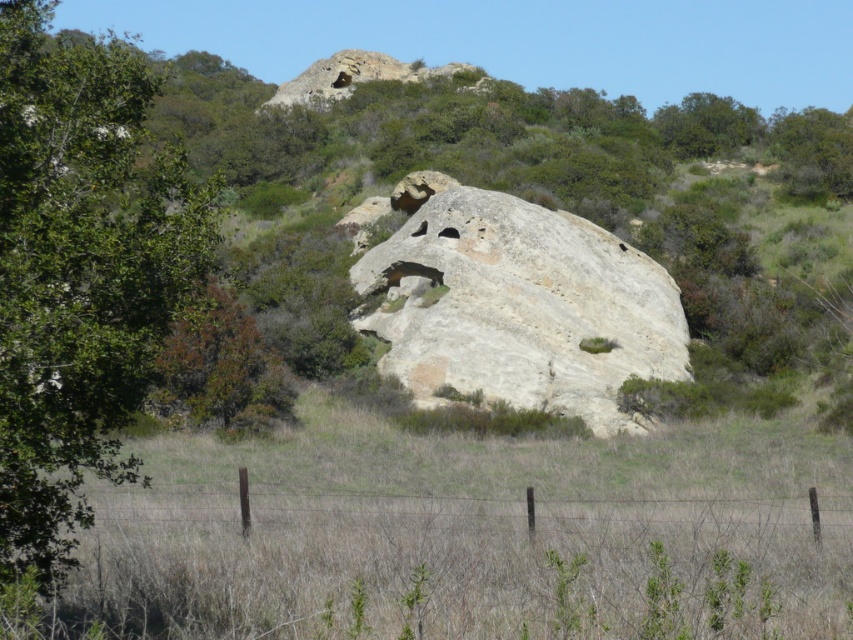
What do you see at coordinates (515, 305) in the screenshot? I see `light gray rock at center` at bounding box center [515, 305].

How much distance is there between light gray rock at center and green leafy shrub at center-left?

light gray rock at center and green leafy shrub at center-left are 28.78 feet apart.

This screenshot has height=640, width=853. What do you see at coordinates (515, 305) in the screenshot? I see `light gray rock at center` at bounding box center [515, 305].

Identify the location of light gray rock at center. (515, 305).

From the picture: Is brown wire fence at lower center above green leafy shrub at center-left?

No, brown wire fence at lower center is not above green leafy shrub at center-left.

Is point (219, 502) closer to viewer compared to point (256, 420)?

Yes.

Is point (552, 515) positioned behind point (231, 314)?

No, it is not.

Locate an element on the screen. brown wire fence at lower center is located at coordinates (699, 512).

Who is shorter, light gray rock at center or green leafy tree at upper right?

Standing shorter between the two is light gray rock at center.

Can you confirm if light gray rock at center is positioned below green leafy tree at upper right?

Yes, light gray rock at center is below green leafy tree at upper right.

This screenshot has height=640, width=853. I want to click on light gray rock at center, so click(515, 305).